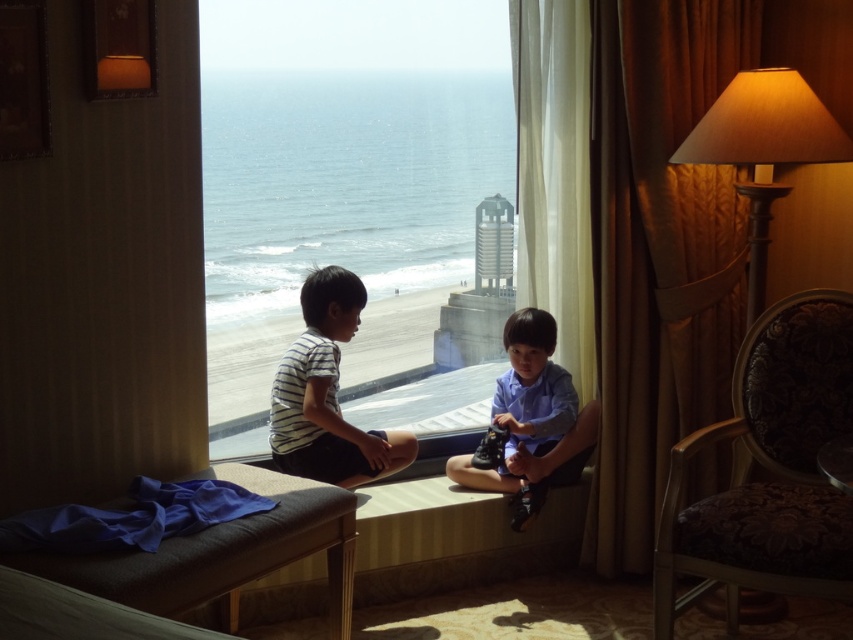
Can you confirm if transparent glass window at center is smaller than blue smooth shirt at center?

No.

Can you confirm if transparent glass window at center is positioned above blue smooth shirt at center?

Yes, transparent glass window at center is above blue smooth shirt at center.

Between point (254, 432) and point (540, 397), which one is positioned in front?

Point (254, 432)

I want to click on transparent glass window at center, so click(347, 195).

Is blue fabric at lower left below striped cotton shirt at center?

Indeed, blue fabric at lower left is positioned under striped cotton shirt at center.

Measure the distance between point (169, 584) and camera.

Point (169, 584) is 2.07 meters from camera.

Is point (9, 563) behind point (340, 333)?

No, (9, 563) is in front of (340, 333).

Find the location of a particular element. blue fabric at lower left is located at coordinates (223, 552).

Does striped cotton shirt at center have a lesser width compared to blue smooth shirt at center?

Yes.

Between point (314, 294) and point (553, 362), which one is positioned in front?

Point (314, 294) is more forward.

Does point (317, 401) lie behind point (529, 332)?

No, (317, 401) is in front of (529, 332).

Find the location of a particular element. The image size is (853, 640). striped cotton shirt at center is located at coordinates (328, 394).